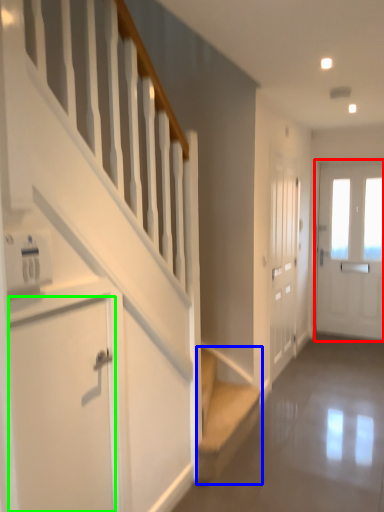
Question: Considering the real-world distances, which object is closest to door (highlighted by a red box)? stairs (highlighted by a blue box) or door (highlighted by a green box).

Choices:
 (A) stairs
 (B) door

Answer: (A)